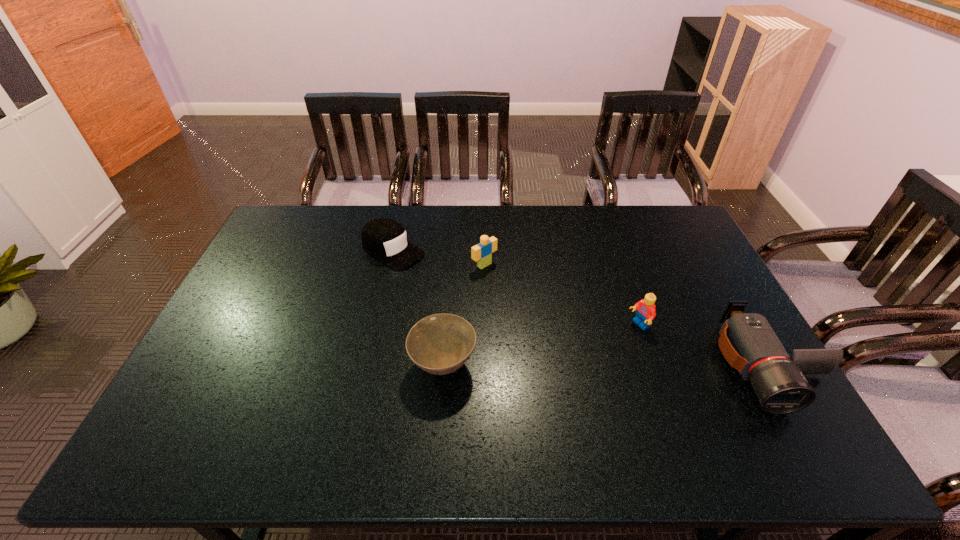
Locate an element on the screen. Image resolution: width=960 pixels, height=540 pixels. blank space located on the face of the left Lego is located at coordinates (519, 292).

Find the location of a particular element. blank space located on the face of the left Lego is located at coordinates (550, 315).

You are a GUI agent. You are given a task and a screenshot of the screen. Output one action in this format:
    pyautogui.click(x=<x>, y=<y>)
    Task: Click on the free spot located 0.240m on the face of the left Lego
    Image resolution: width=960 pixels, height=540 pixels.
    Given the screenshot: What is the action you would take?
    pyautogui.click(x=545, y=312)

Locate an element on the screen. This screenshot has width=960, height=540. free region located 0.290m on the front-facing side of the cap is located at coordinates (480, 306).

Image resolution: width=960 pixels, height=540 pixels. I want to click on vacant area situated on the front-facing side of the cap, so tap(474, 302).

The image size is (960, 540). I want to click on vacant space located on the front-facing side of the cap, so click(477, 304).

You are a GUI agent. You are given a task and a screenshot of the screen. Output one action in this format:
    pyautogui.click(x=<x>, y=<y>)
    Task: Click on the object at the far edge
    Image resolution: width=960 pixels, height=540 pixels.
    Given the screenshot: What is the action you would take?
    pyautogui.click(x=385, y=239)

Locate an element on the screen. bowl located at the near edge is located at coordinates (439, 344).

At what (x,y) coordinates should I click in order to perform the action: click on camcorder at the near edge. Please return your answer as a coordinate pair (x, y). The width and height of the screenshot is (960, 540). Looking at the image, I should click on (747, 341).

Identify the location of object that is positioned at the right edge. The width and height of the screenshot is (960, 540). (747, 341).